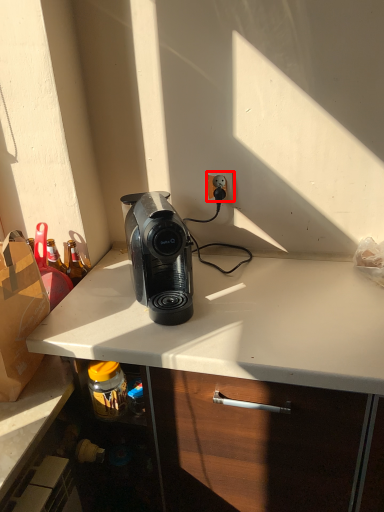
Question: Observing the image, what is the correct spatial positioning of power outlet (annotated by the red box) in reference to home appliance?

Choices:
 (A) left
 (B) right

Answer: (B)